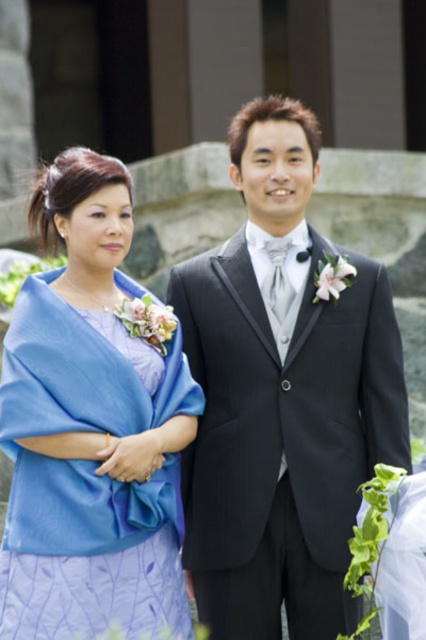
Question: Does shiny black suit at center have a smaller size compared to lavender satin dress at left?

Choices:
 (A) yes
 (B) no

Answer: (B)

Question: Is shiny black suit at center wider than lavender satin dress at left?

Choices:
 (A) yes
 (B) no

Answer: (A)

Question: Does shiny black suit at center lie in front of lavender satin dress at left?

Choices:
 (A) yes
 (B) no

Answer: (B)

Question: Which point appears closest to the camera in this image?

Choices:
 (A) (138, 500)
 (B) (324, 307)

Answer: (A)